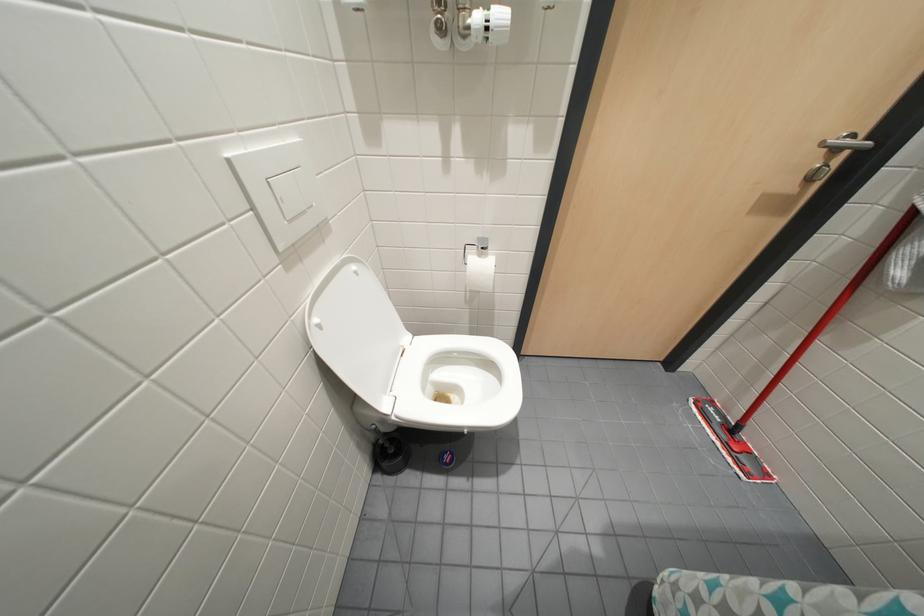
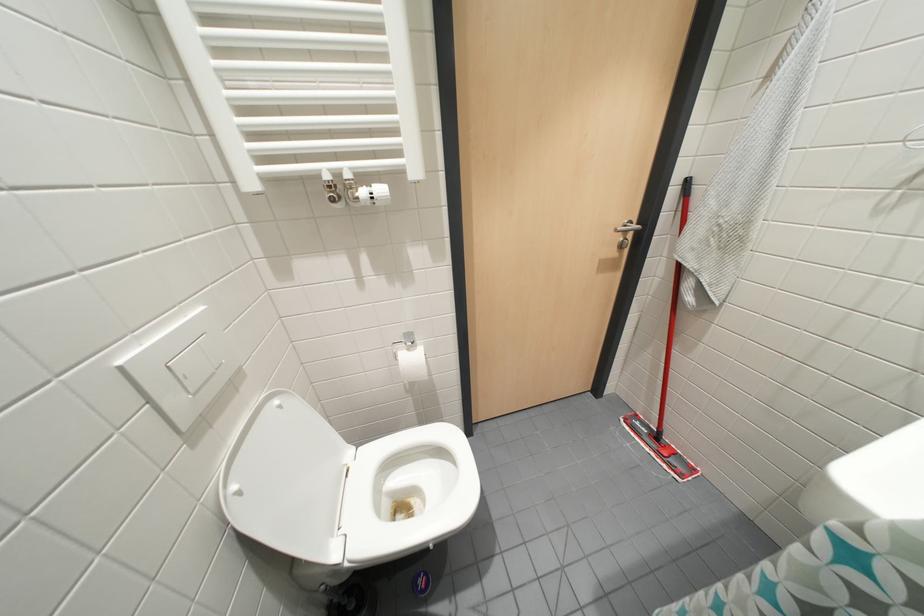
In a continuous first-person perspective shot, in which direction is the camera moving?

The cameraman moved toward right, backward.